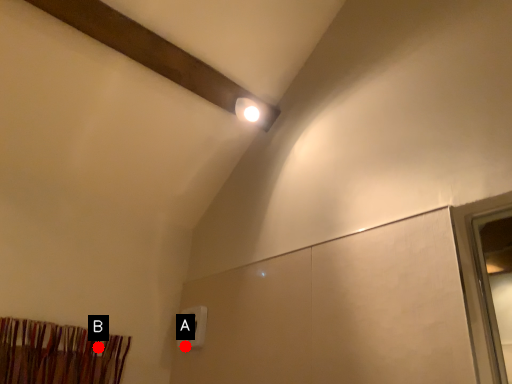
Question: Two points are circled on the image, labeled by A and B beside each circle. Which of the following is the farthest from the observer?

Choices:
 (A) A is further
 (B) B is further

Answer: (A)